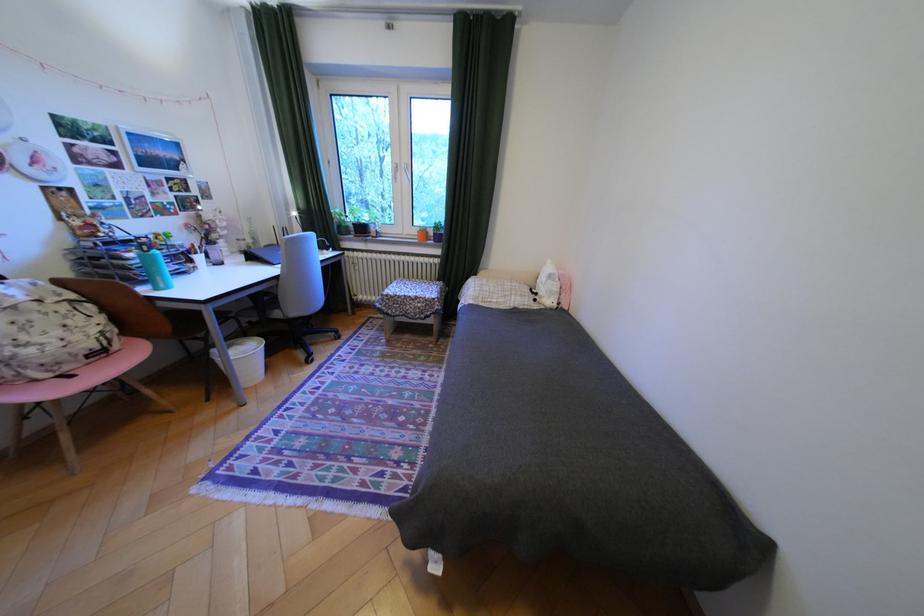
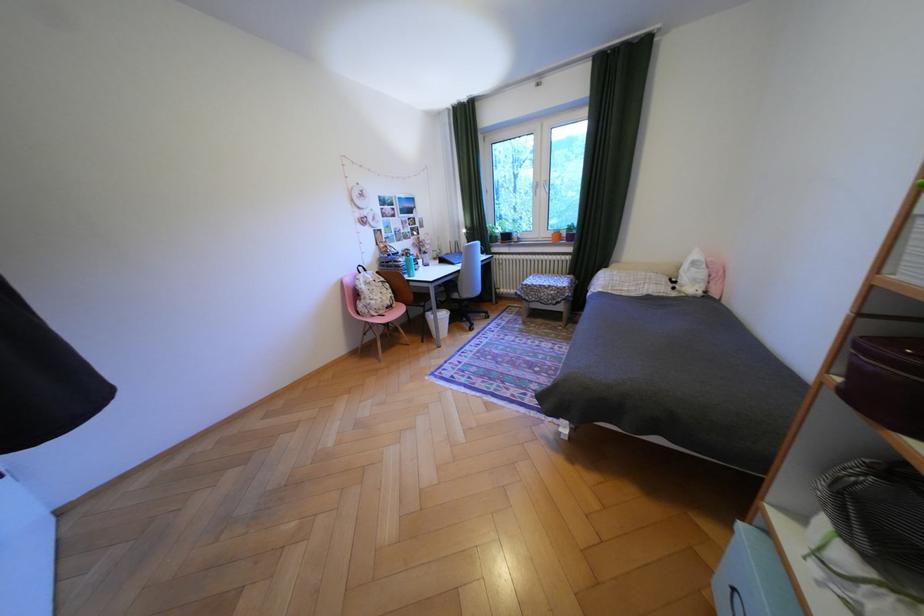
Where in the second image is the point corresponding to point 548,294 from the first image?

(687, 282)